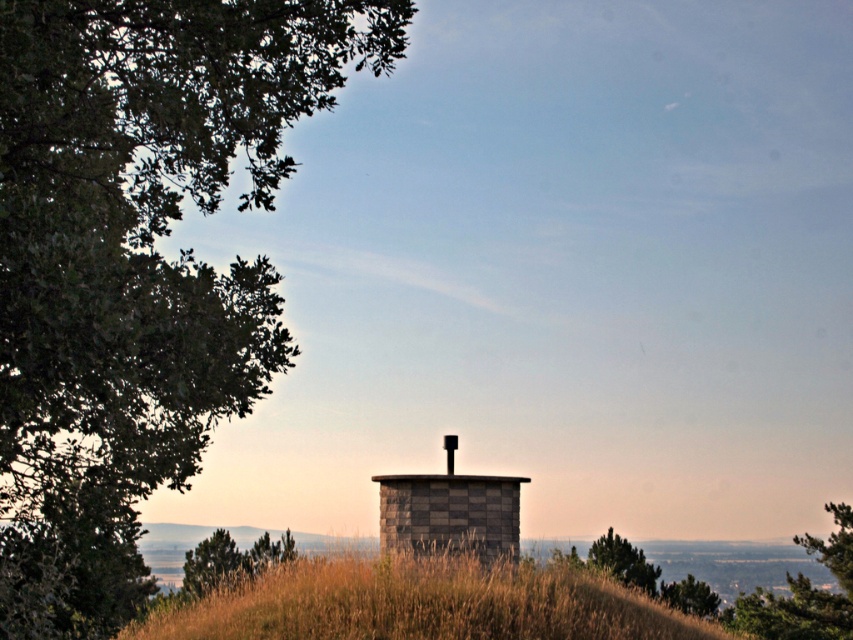
You are standing on the brown grassy hillside at center and want to walk to the green textured tree at center. Which direction should you head towards?

The brown grassy hillside at center is positioned on the left side of the green textured tree at center, so you should head towards the right to reach the green textured tree at center.

You are standing at the base of the tree on the left side of the scene and want to walk to the stone structure in the middle ground. There are two points marked on your path. Which point, point (291, 22) or point (624, 556), is closer to you as you begin your journey?

Point (291, 22) is closer to you than point (624, 556).